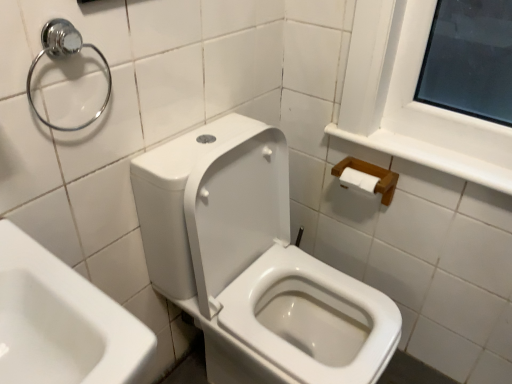
Question: Is white glossy toilet at center taller than chrome metallic towel ring at upper left?

Choices:
 (A) yes
 (B) no

Answer: (A)

Question: Does white glossy toilet at center have a smaller size compared to chrome metallic towel ring at upper left?

Choices:
 (A) no
 (B) yes

Answer: (A)

Question: From a real-world perspective, is white glossy toilet at center beneath chrome metallic towel ring at upper left?

Choices:
 (A) no
 (B) yes

Answer: (B)

Question: Is white glossy toilet at center positioned with its back to chrome metallic towel ring at upper left?

Choices:
 (A) no
 (B) yes

Answer: (A)

Question: Can you confirm if white glossy toilet at center is wider than chrome metallic towel ring at upper left?

Choices:
 (A) yes
 (B) no

Answer: (A)

Question: From a real-world perspective, is chrome metallic towel ring at upper left positioned above or below wooden tissue holder at upper right?

Choices:
 (A) above
 (B) below

Answer: (A)

Question: Considering the relative positions of chrome metallic towel ring at upper left and wooden tissue holder at upper right in the image provided, is chrome metallic towel ring at upper left to the left or to the right of wooden tissue holder at upper right?

Choices:
 (A) left
 (B) right

Answer: (A)

Question: Is point (38, 57) positioned closer to the camera than point (408, 155)?

Choices:
 (A) closer
 (B) farther

Answer: (A)

Question: In the image, is chrome metallic towel ring at upper left positioned in front of or behind wooden tissue holder at upper right?

Choices:
 (A) front
 (B) behind

Answer: (A)

Question: Relative to white glossy toilet at center, is wooden tissue holder at upper right in front or behind?

Choices:
 (A) behind
 (B) front

Answer: (A)

Question: From a real-world perspective, is wooden tissue holder at upper right physically located above or below white glossy toilet at center?

Choices:
 (A) below
 (B) above

Answer: (B)

Question: Looking at the image, does wooden tissue holder at upper right seem bigger or smaller compared to white glossy toilet at center?

Choices:
 (A) big
 (B) small

Answer: (B)

Question: From their relative heights in the image, would you say wooden tissue holder at upper right is taller or shorter than white glossy toilet at center?

Choices:
 (A) short
 (B) tall

Answer: (A)

Question: Is point (422, 162) positioned closer to the camera than point (46, 36)?

Choices:
 (A) farther
 (B) closer

Answer: (A)

Question: In the image, is wooden tissue holder at upper right on the left side or the right side of chrome metallic towel ring at upper left?

Choices:
 (A) right
 (B) left

Answer: (A)